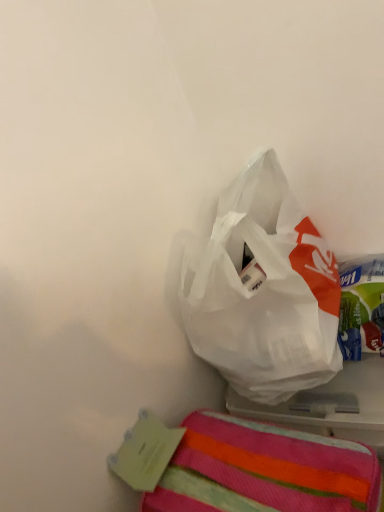
Question: Does striped cotton towel at lower right have a lesser height compared to transparent plastic bag at upper center?

Choices:
 (A) no
 (B) yes

Answer: (B)

Question: Is striped cotton towel at lower right taller than transparent plastic bag at upper center?

Choices:
 (A) yes
 (B) no

Answer: (B)

Question: From the image's perspective, does striped cotton towel at lower right appear lower than transparent plastic bag at upper center?

Choices:
 (A) yes
 (B) no

Answer: (A)

Question: From the image's perspective, would you say striped cotton towel at lower right is positioned over transparent plastic bag at upper center?

Choices:
 (A) no
 (B) yes

Answer: (A)

Question: Does striped cotton towel at lower right have a smaller size compared to transparent plastic bag at upper center?

Choices:
 (A) yes
 (B) no

Answer: (A)

Question: Can you confirm if striped cotton towel at lower right is positioned to the left of transparent plastic bag at upper center?

Choices:
 (A) no
 (B) yes

Answer: (B)

Question: Is transparent plastic bag at upper center at the left side of striped cotton towel at lower right?

Choices:
 (A) yes
 (B) no

Answer: (B)

Question: Is the depth of transparent plastic bag at upper center less than that of striped cotton towel at lower right?

Choices:
 (A) no
 (B) yes

Answer: (A)

Question: Is transparent plastic bag at upper center smaller than striped cotton towel at lower right?

Choices:
 (A) no
 (B) yes

Answer: (A)

Question: Considering the relative sizes of transparent plastic bag at upper center and striped cotton towel at lower right in the image provided, is transparent plastic bag at upper center bigger than striped cotton towel at lower right?

Choices:
 (A) no
 (B) yes

Answer: (B)

Question: From the image's perspective, is transparent plastic bag at upper center above striped cotton towel at lower right?

Choices:
 (A) yes
 (B) no

Answer: (A)

Question: Is transparent plastic bag at upper center not within striped cotton towel at lower right?

Choices:
 (A) yes
 (B) no

Answer: (A)

Question: From the image's perspective, is striped cotton towel at lower right above or below transparent plastic bag at upper center?

Choices:
 (A) below
 (B) above

Answer: (A)